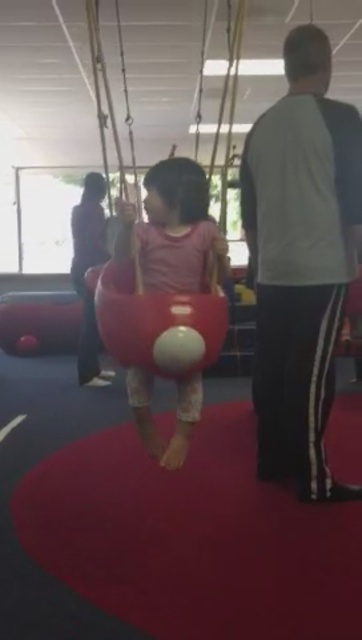
You are designing a play area and want to place a swing that takes up less space. Which swing between the matte pink swing at center and the matte plastic swing at center would you choose?

The matte pink swing at center is thinner than the matte plastic swing at center, so it would take up less space and be the better choice for the play area.

In the scene shown: You are standing in the play area and want to place a small toy between the two points, point (x=145, y=268) and point (x=86, y=275). Which point should you place the toy closer to so that it appears larger to someone looking from the front?

You should place the toy closer to point (x=145, y=268) because it is closer to the viewer, making the toy appear larger when viewed from the front.

You are designing a play area and want to place both the matte pink swing at center and the matte plastic swing at center in the same space. Which swing should you place first to ensure there is enough room for both?

You should place the matte pink swing at center first since it is bigger than the matte plastic swing at center, ensuring there is enough space for both.